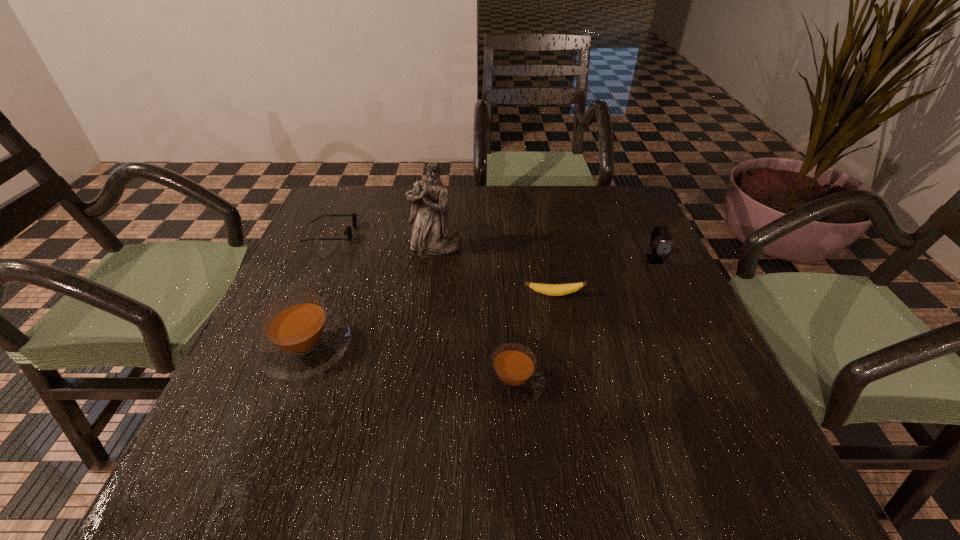
You are a GUI agent. You are given a task and a screenshot of the screen. Output one action in this format:
    pyautogui.click(x=<x>, y=<y>)
    Task: Click on the left cappuccino
    
    Given the screenshot: What is the action you would take?
    pyautogui.click(x=302, y=338)

You are a GUI agent. You are given a task and a screenshot of the screen. Output one action in this format:
    pyautogui.click(x=<x>, y=<y>)
    Task: Click on the third shortest object
    This screenshot has width=960, height=540.
    Given the screenshot: What is the action you would take?
    pyautogui.click(x=512, y=377)

This screenshot has width=960, height=540. In order to click on the right cappuccino in this screenshot , I will do `click(512, 377)`.

Identify the location of the third nearest object. (548, 289).

Where is `the tallest object`? the tallest object is located at coordinates (430, 237).

Where is `the fourth object from right to left`? The width and height of the screenshot is (960, 540). the fourth object from right to left is located at coordinates (430, 237).

Where is `the rightmost object`? Image resolution: width=960 pixels, height=540 pixels. the rightmost object is located at coordinates (665, 247).

Image resolution: width=960 pixels, height=540 pixels. I want to click on sunglasses, so click(x=348, y=231).

Where is `vacant space located on the back of the taller cappuccino`? This screenshot has width=960, height=540. vacant space located on the back of the taller cappuccino is located at coordinates (336, 270).

The width and height of the screenshot is (960, 540). Identify the location of free space located 0.380m on the back of the fourth tallest object. (503, 241).